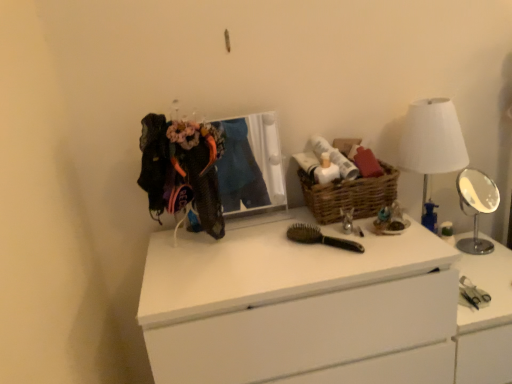
Identify the location of free space in front of woven brown basket at center. (356, 245).